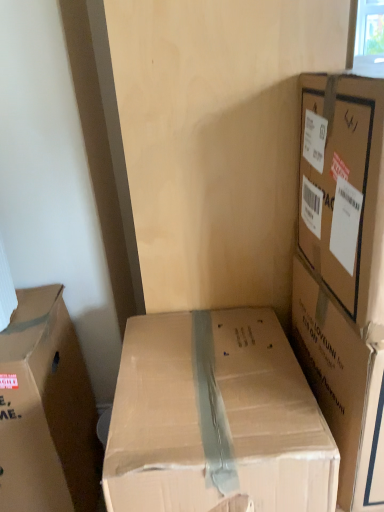
Question: From the image's perspective, is brown cardboard box at center, the second box viewed from the right, on brown cardboard box at left, which appears as the 1th box when viewed from the left?

Choices:
 (A) yes
 (B) no

Answer: (B)

Question: Is brown cardboard box at center, the second box viewed from the left, next to brown cardboard box at left, which appears as the 1th box when viewed from the left?

Choices:
 (A) yes
 (B) no

Answer: (B)

Question: Considering the relative sizes of brown cardboard box at center, the second box viewed from the left, and brown cardboard box at left, which appears as the 1th box when viewed from the left, in the image provided, is brown cardboard box at center, the second box viewed from the left, taller than brown cardboard box at left, which appears as the 1th box when viewed from the left,?

Choices:
 (A) no
 (B) yes

Answer: (B)

Question: From a real-world perspective, is brown cardboard box at center, the second box viewed from the right, positioned under brown cardboard box at left, which appears as the 1th box when viewed from the left, based on gravity?

Choices:
 (A) yes
 (B) no

Answer: (A)

Question: Is brown cardboard box at center, the second box viewed from the left, aimed at brown cardboard box at left, which appears as the 1th box when viewed from the left?

Choices:
 (A) no
 (B) yes

Answer: (A)

Question: From the image's perspective, is brown cardboard box at center, the second box viewed from the right, above or below brown cardboard box at upper right, which ranks as the third box in left-to-right order?

Choices:
 (A) above
 (B) below

Answer: (B)

Question: Is brown cardboard box at center, the second box viewed from the right, bigger or smaller than brown cardboard box at upper right, the first box positioned from the right?

Choices:
 (A) small
 (B) big

Answer: (B)

Question: Do you think brown cardboard box at center, the second box viewed from the left, is within brown cardboard box at upper right, which ranks as the third box in left-to-right order, or outside of it?

Choices:
 (A) outside
 (B) inside

Answer: (A)

Question: Considering the relative positions of brown cardboard box at center, the second box viewed from the right, and brown cardboard box at upper right, the first box positioned from the right, in the image provided, is brown cardboard box at center, the second box viewed from the right, to the left or to the right of brown cardboard box at upper right, the first box positioned from the right,?

Choices:
 (A) right
 (B) left

Answer: (B)

Question: From their relative heights in the image, would you say brown cardboard box at left, which appears as the 1th box when viewed from the left, is taller or shorter than brown cardboard box at center, the second box viewed from the left?

Choices:
 (A) tall
 (B) short

Answer: (B)

Question: From a real-world perspective, is brown cardboard box at left, the third box viewed from the right, positioned above or below brown cardboard box at center, the second box viewed from the right?

Choices:
 (A) above
 (B) below

Answer: (A)

Question: Considering the positions of brown cardboard box at left, the third box viewed from the right, and brown cardboard box at center, the second box viewed from the left, in the image, is brown cardboard box at left, the third box viewed from the right, wider or thinner than brown cardboard box at center, the second box viewed from the left,?

Choices:
 (A) wide
 (B) thin

Answer: (B)

Question: Considering the positions of brown cardboard box at left, which appears as the 1th box when viewed from the left, and brown cardboard box at center, the second box viewed from the right, in the image, is brown cardboard box at left, which appears as the 1th box when viewed from the left, bigger or smaller than brown cardboard box at center, the second box viewed from the right,?

Choices:
 (A) small
 (B) big

Answer: (A)

Question: Based on their sizes in the image, would you say brown cardboard box at upper right, the first box positioned from the right, is bigger or smaller than brown cardboard box at left, which appears as the 1th box when viewed from the left?

Choices:
 (A) small
 (B) big

Answer: (A)

Question: Is brown cardboard box at upper right, the first box positioned from the right, inside the boundaries of brown cardboard box at left, the third box viewed from the right, or outside?

Choices:
 (A) inside
 (B) outside

Answer: (B)